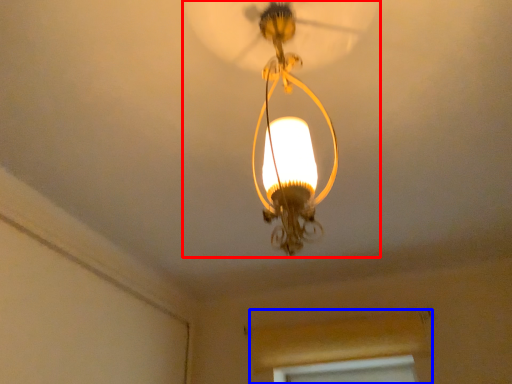
Question: Which object is further to the camera taking this photo, lamp (highlighted by a red box) or window frame (highlighted by a blue box)?

Choices:
 (A) lamp
 (B) window frame

Answer: (B)